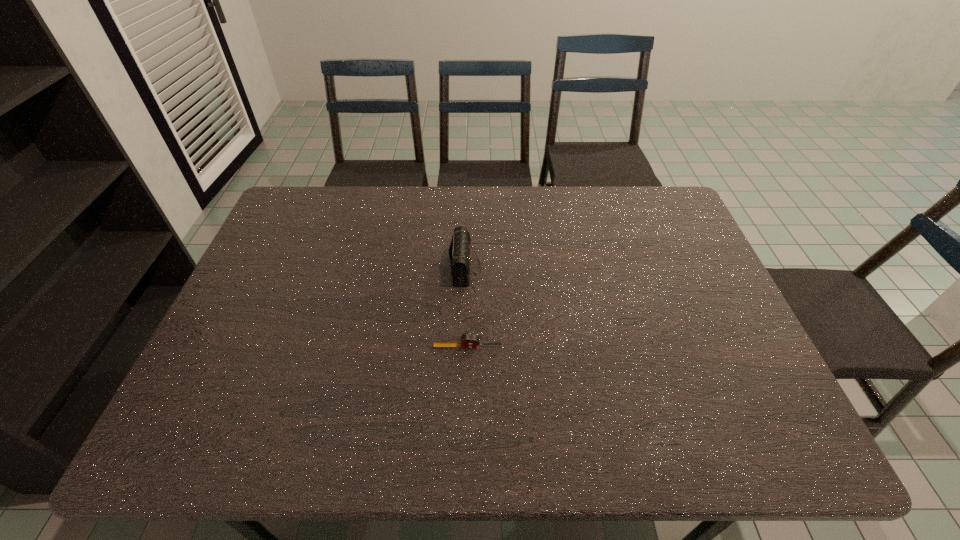
Where is `vacant region that satisfies the following two spatial constraints: 1. on the front flap of the taller object; 2. on the right side of the nearer object`? Image resolution: width=960 pixels, height=540 pixels. vacant region that satisfies the following two spatial constraints: 1. on the front flap of the taller object; 2. on the right side of the nearer object is located at coordinates (463, 347).

The height and width of the screenshot is (540, 960). Find the location of `vacant space that satisfies the following two spatial constraints: 1. on the front flap of the nearer object; 2. on the left side of the taller object`. vacant space that satisfies the following two spatial constraints: 1. on the front flap of the nearer object; 2. on the left side of the taller object is located at coordinates (463, 347).

Locate an element on the screen. This screenshot has height=540, width=960. blank area in the image that satisfies the following two spatial constraints: 1. on the front flap of the taller object; 2. on the left side of the shorter object is located at coordinates (463, 347).

Locate an element on the screen. blank space that satisfies the following two spatial constraints: 1. on the front flap of the tape measure; 2. on the left side of the clutch bag is located at coordinates (463, 347).

The height and width of the screenshot is (540, 960). In order to click on vacant area that satisfies the following two spatial constraints: 1. on the front flap of the farther object; 2. on the right side of the tape measure in this screenshot , I will do [463, 347].

Find the location of a particular element. The image size is (960, 540). free region that satisfies the following two spatial constraints: 1. on the front flap of the clutch bag; 2. on the left side of the shorter object is located at coordinates (463, 347).

Where is `blank space that satisfies the following two spatial constraints: 1. on the front flap of the farther object; 2. on the left side of the shorter object`? blank space that satisfies the following two spatial constraints: 1. on the front flap of the farther object; 2. on the left side of the shorter object is located at coordinates (463, 347).

Identify the location of free space that satisfies the following two spatial constraints: 1. on the front flap of the farther object; 2. on the right side of the tape measure. The height and width of the screenshot is (540, 960). (463, 347).